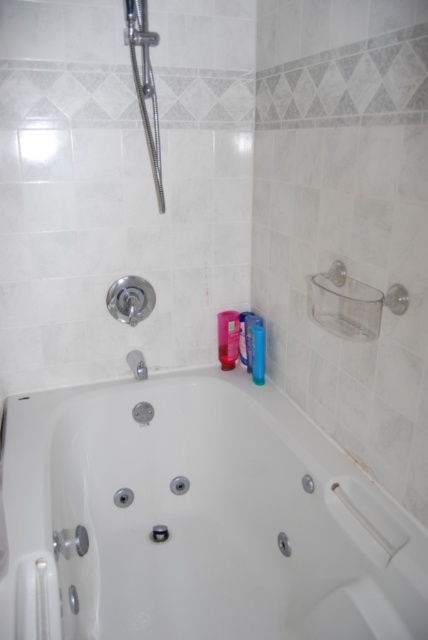
Is point (222, 362) farther from camera compared to point (261, 378)?

That is True.

Between pink plastic bottle at upper right and blue plastic bottle at upper right, which one has more height?

pink plastic bottle at upper right

Identify the location of pink plastic bottle at upper right. This screenshot has width=428, height=640. (228, 339).

Locate an element on the screen. This screenshot has width=428, height=640. pink plastic bottle at upper right is located at coordinates (228, 339).

Is polished chrome showerhead at upper left wider than pink plastic bottle at upper right?

Yes.

Is polished chrome showerhead at upper left thinner than pink plastic bottle at upper right?

Incorrect, polished chrome showerhead at upper left's width is not less than pink plastic bottle at upper right's.

At what (x,y) coordinates should I click in order to perform the action: click on polished chrome showerhead at upper left. Please return your answer as a coordinate pair (x, y). Image resolution: width=428 pixels, height=640 pixels. Looking at the image, I should click on (130, 300).

Which is behind, point (58, 433) or point (225, 362)?

Point (225, 362)

Does white glossy bathtub at center appear on the left side of pink plastic bottle at upper right?

Correct, you'll find white glossy bathtub at center to the left of pink plastic bottle at upper right.

Is point (240, 396) less distant than point (235, 337)?

Yes, point (240, 396) is in front of point (235, 337).

I want to click on white glossy bathtub at center, so click(x=196, y=518).